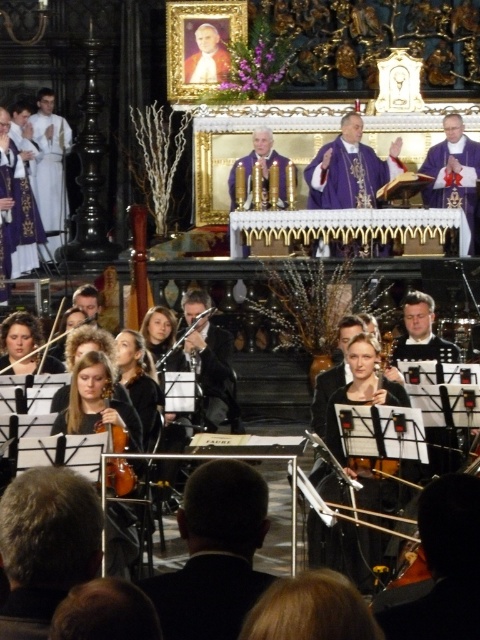
How much distance is there between purple satin robe at upper center and white silk robe at left?

purple satin robe at upper center and white silk robe at left are 82.85 feet apart.

Which is in front, point (337, 156) or point (38, 134)?

Point (337, 156)

Is point (337, 250) more distant than point (40, 118)?

No, (337, 250) is in front of (40, 118).

I want to click on purple satin robe at upper center, so click(x=349, y=170).

Who is more forward, (348, 189) or (120, 497)?

Positioned in front is point (120, 497).

Which is behind, point (371, 163) or point (133, 486)?

The point (371, 163) is more distant.

Is point (372, 189) in front of point (131, 483)?

No.

Find the location of a particular element. This screenshot has height=640, width=480. purple satin robe at upper center is located at coordinates (349, 170).

Between purple velvet robe at left and matte brown violin at lower left, which one appears on the right side from the viewer's perspective?

Positioned to the right is matte brown violin at lower left.

Which is above, purple velvet robe at left or matte brown violin at lower left?

purple velvet robe at left is higher up.

Between point (9, 180) and point (120, 486), which one is positioned behind?

The point (9, 180) is behind.

Locate an element on the screen. purple velvet robe at left is located at coordinates (19, 212).